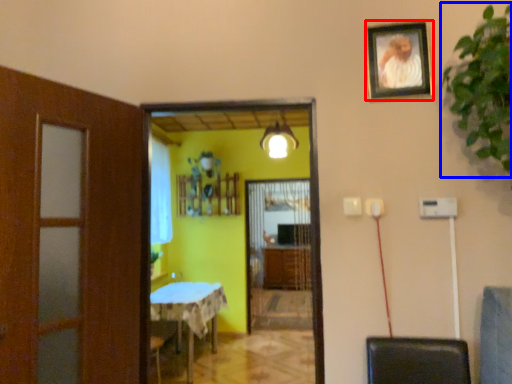
Question: Which object is further to the camera taking this photo, picture frame (highlighted by a red box) or plant (highlighted by a blue box)?

Choices:
 (A) picture frame
 (B) plant

Answer: (A)